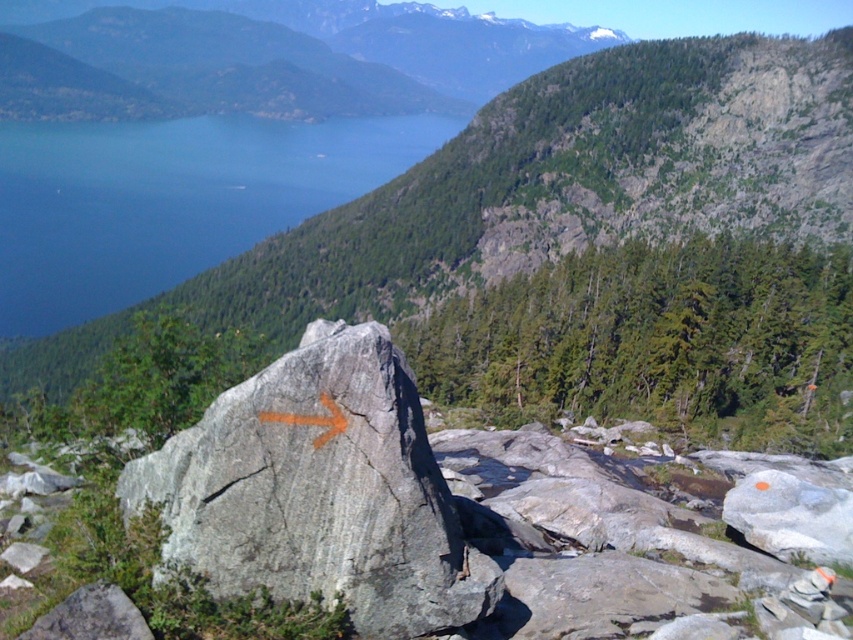
What do you see at coordinates (570, 180) in the screenshot?
I see `granite boulder at center` at bounding box center [570, 180].

Locate an element on the screen. granite boulder at center is located at coordinates (570, 180).

Locate an element on the screen. The width and height of the screenshot is (853, 640). granite boulder at center is located at coordinates (570, 180).

Who is more forward, (135,44) or (262,417)?

Point (262,417) is more forward.

Does point (111, 115) come behind point (283, 413)?

That is True.

Identify the location of green forested mountain at upper center. 288,56.

Which of these two, white smooth rock at lower right or orange painted arrow at center, stands shorter?

orange painted arrow at center is shorter.

Can you confirm if white smooth rock at lower right is positioned below orange painted arrow at center?

Yes, white smooth rock at lower right is below orange painted arrow at center.

Does point (840, 518) come closer to viewer compared to point (328, 400)?

No, it is behind (328, 400).

In order to click on white smooth rock at lower right in this screenshot , I will do `click(791, 516)`.